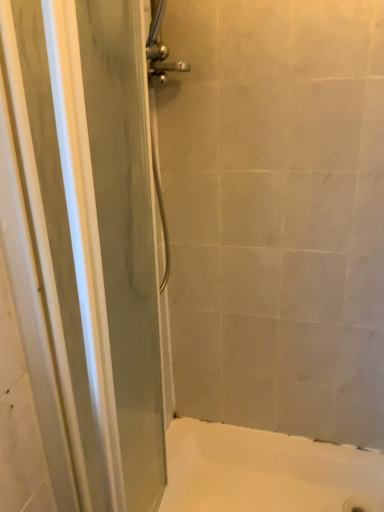
Question: Is white smooth bathtub at lower center at the left side of transparent glass screen door at left?

Choices:
 (A) yes
 (B) no

Answer: (B)

Question: Is white smooth bathtub at lower center oriented away from transparent glass screen door at left?

Choices:
 (A) no
 (B) yes

Answer: (A)

Question: From a real-world perspective, is white smooth bathtub at lower center beneath transparent glass screen door at left?

Choices:
 (A) yes
 (B) no

Answer: (A)

Question: Does white smooth bathtub at lower center have a greater width compared to transparent glass screen door at left?

Choices:
 (A) yes
 (B) no

Answer: (A)

Question: From a real-world perspective, is white smooth bathtub at lower center over transparent glass screen door at left?

Choices:
 (A) no
 (B) yes

Answer: (A)

Question: Is white smooth bathtub at lower center facing towards transparent glass screen door at left?

Choices:
 (A) no
 (B) yes

Answer: (A)

Question: From a real-world perspective, does transparent glass screen door at left stand above white smooth bathtub at lower center?

Choices:
 (A) yes
 (B) no

Answer: (A)

Question: From a real-world perspective, is transparent glass screen door at left located beneath white smooth bathtub at lower center?

Choices:
 (A) no
 (B) yes

Answer: (A)

Question: Can you confirm if transparent glass screen door at left is thinner than white smooth bathtub at lower center?

Choices:
 (A) yes
 (B) no

Answer: (A)

Question: Is transparent glass screen door at left facing towards white smooth bathtub at lower center?

Choices:
 (A) yes
 (B) no

Answer: (B)

Question: Can you confirm if transparent glass screen door at left is wider than white smooth bathtub at lower center?

Choices:
 (A) no
 (B) yes

Answer: (A)

Question: Is transparent glass screen door at left directly adjacent to white smooth bathtub at lower center?

Choices:
 (A) no
 (B) yes

Answer: (A)

Question: Considering the positions of white smooth bathtub at lower center and transparent glass screen door at left in the image, is white smooth bathtub at lower center taller or shorter than transparent glass screen door at left?

Choices:
 (A) tall
 (B) short

Answer: (B)